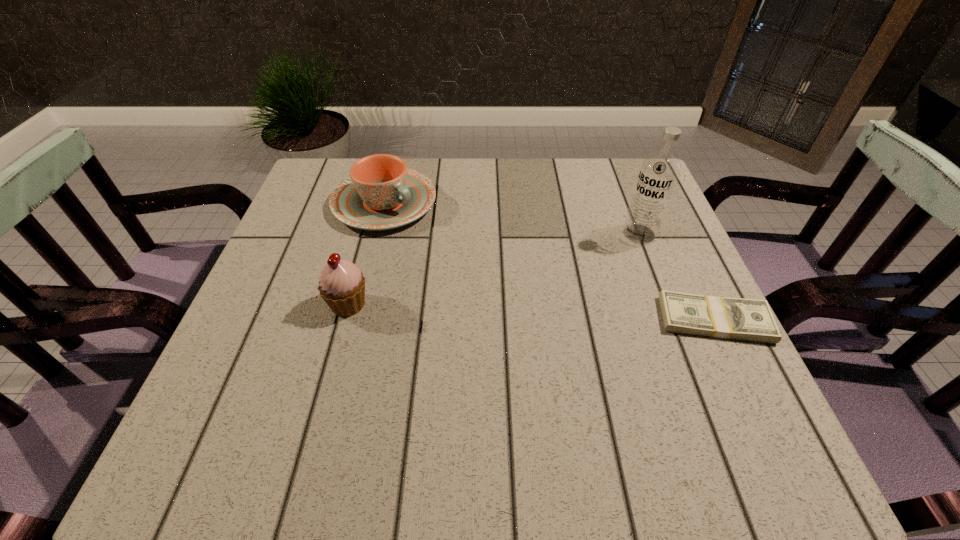
Identify the location of unoccupied position between the dollar and the cupcake. This screenshot has height=540, width=960. (532, 312).

Locate an element on the screen. vacant space in between the tallest object and the third shortest object is located at coordinates (493, 269).

Locate an element on the screen. empty space that is in between the cupcake and the dollar is located at coordinates (532, 312).

Identify which object is the nearest to the vodka. Please provide its 2D coordinates. Your answer should be formatted as a tuple, i.e. [(x, y)], where the tuple contains the x and y coordinates of a point satisfying the conditions above.

[(719, 317)]

The height and width of the screenshot is (540, 960). Find the location of `object that is the closest to the dollar`. object that is the closest to the dollar is located at coordinates (659, 172).

The width and height of the screenshot is (960, 540). Identify the location of vacant area in the image that satisfies the following two spatial constraints: 1. on the front side of the second shortest object; 2. on the left side of the tallest object. (376, 234).

Find the location of `free spot that satisfies the following two spatial constraints: 1. on the front side of the vodka; 2. on the right side of the third tallest object`. free spot that satisfies the following two spatial constraints: 1. on the front side of the vodka; 2. on the right side of the third tallest object is located at coordinates (376, 234).

The width and height of the screenshot is (960, 540). In order to click on free space that satisfies the following two spatial constraints: 1. on the front side of the shortest object; 2. on the right side of the second tallest object in this screenshot , I will do `click(344, 320)`.

Identify the location of vacant area in the image that satisfies the following two spatial constraints: 1. on the front side of the second shortest object; 2. on the left side of the shortest object. This screenshot has height=540, width=960. point(355,320).

Where is `free location that satisfies the following two spatial constraints: 1. on the front side of the vodka; 2. on the left side of the shortest object`? free location that satisfies the following two spatial constraints: 1. on the front side of the vodka; 2. on the left side of the shortest object is located at coordinates (672, 320).